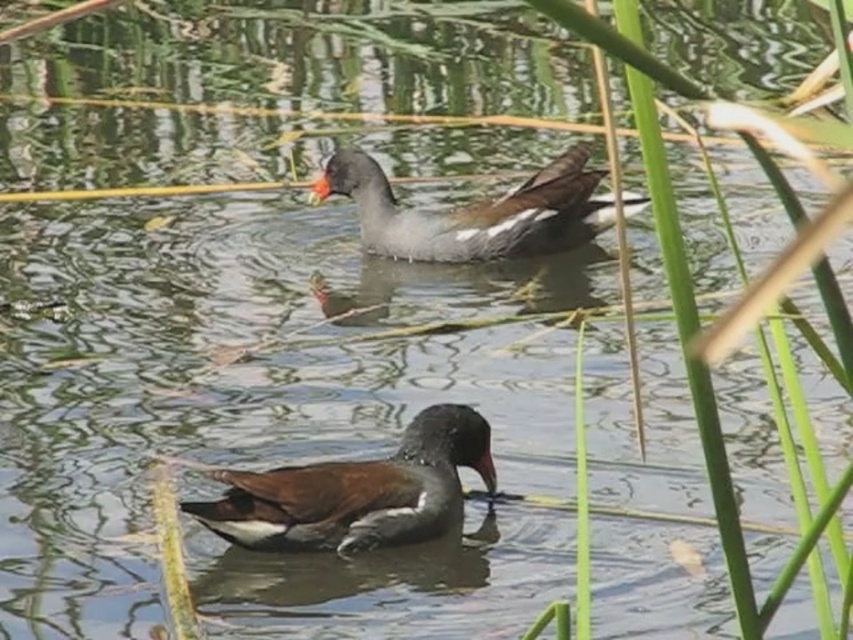
Question: Is dark gray matte duck at center bigger than gray matte duck at upper center?

Choices:
 (A) yes
 (B) no

Answer: (B)

Question: Which point is closer to the camera taking this photo?

Choices:
 (A) (354, 200)
 (B) (282, 516)

Answer: (B)

Question: Which object appears farthest from the camera in this image?

Choices:
 (A) gray matte duck at upper center
 (B) dark gray matte duck at center

Answer: (A)

Question: Which of the following is the closest to the observer?

Choices:
 (A) gray matte duck at upper center
 (B) dark gray matte duck at center

Answer: (B)

Question: Is dark gray matte duck at center positioned in front of gray matte duck at upper center?

Choices:
 (A) yes
 (B) no

Answer: (A)

Question: Can you confirm if dark gray matte duck at center is smaller than gray matte duck at upper center?

Choices:
 (A) yes
 (B) no

Answer: (A)